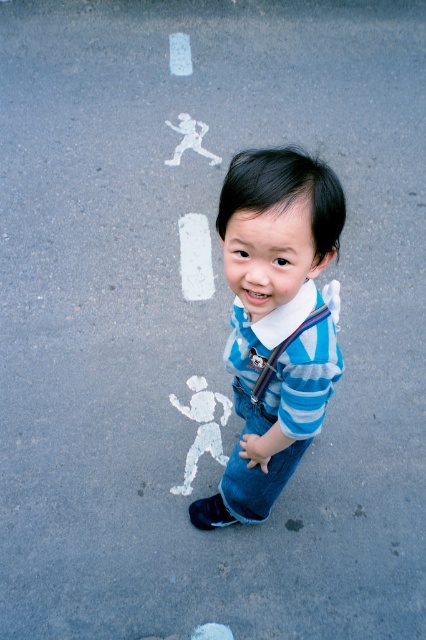
You are a photographer taking a picture of the child wearing a blue and white striped long sleeve shirt. You want to focus on the point at coordinates (275, 323). Where exactly on the child should this point be located?

The point at coordinates (275, 323) is located on the blue striped shirt at center, so focusing there would center the shot on the child.

You are taking a photo of the child and the two chalk drawings. Based on their positions, which point, point [271,186] or point [273,348], will appear closer to the camera in the photo?

Point [271,186] is closer to the camera than point [273,348], so it will appear closer in the photo.

You are a fashion designer observing a child in the scene. The child is wearing a blue striped shirt at center and striped fabric suspenders at center. Which clothing item is higher on the child?

The blue striped shirt at center is taller than striped fabric suspenders at center, so the blue striped shirt at center is higher on the child.